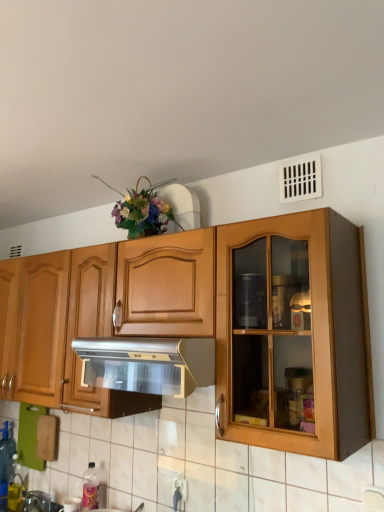
Question: Is silver metallic range hood at center in front of or behind white plastic vent at upper right in the image?

Choices:
 (A) front
 (B) behind

Answer: (A)

Question: In terms of size, does silver metallic range hood at center appear bigger or smaller than white plastic vent at upper right?

Choices:
 (A) big
 (B) small

Answer: (A)

Question: Which object is positioned closest to the white plastic vent at upper right?

Choices:
 (A) translucent plastic bottle at lower left, which ranks as the first bottle in back-to-front order
 (B) pink plastic bottle at lower left, the 1th bottle viewed from the front
 (C) silver metallic range hood at center

Answer: (C)

Question: Estimate the real-world distances between objects in this image. Which object is farther from the pink plastic bottle at lower left, arranged as the 2th bottle when viewed from the back?

Choices:
 (A) white plastic vent at upper right
 (B) silver metallic range hood at center
 (C) translucent plastic bottle at lower left, which ranks as the first bottle in back-to-front order

Answer: (A)